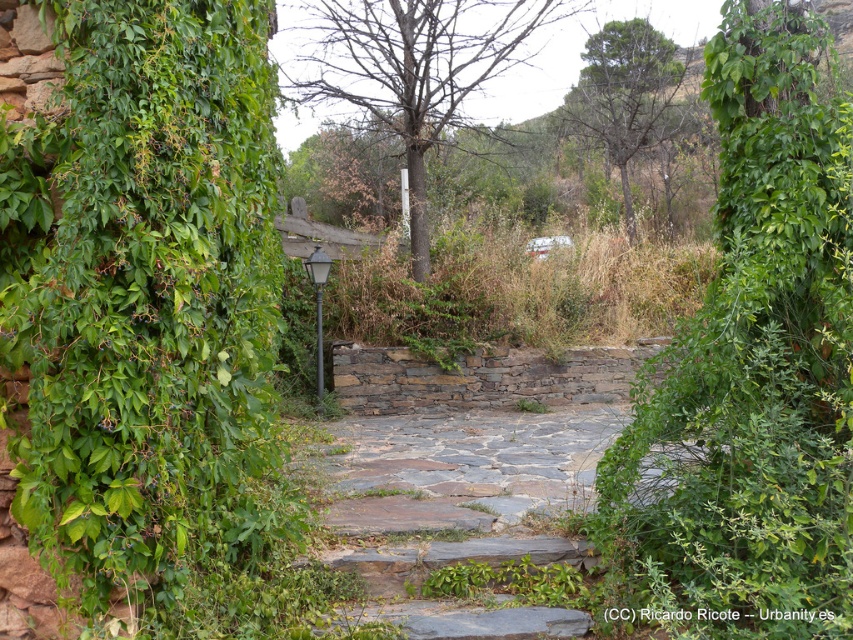
Does green leafy hedge at center have a greater width compared to gray stone steps at center?

In fact, green leafy hedge at center might be narrower than gray stone steps at center.

Between green leafy hedge at center and gray stone steps at center, which one has more height?

Standing taller between the two is green leafy hedge at center.

Does point (831, 168) come closer to viewer compared to point (519, 518)?

Yes, point (831, 168) is in front of point (519, 518).

Find the location of a particular element. This screenshot has width=853, height=640. green leafy hedge at center is located at coordinates (752, 369).